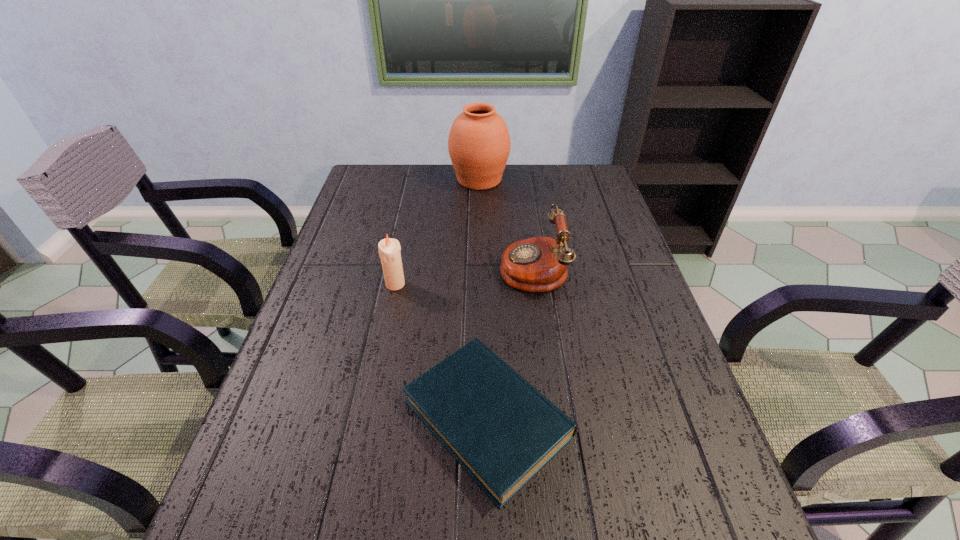
Locate an element on the screen. vacant region that satisfies the following two spatial constraints: 1. on the dial of the telephone; 2. on the front side of the book is located at coordinates click(553, 418).

I want to click on free space that satisfies the following two spatial constraints: 1. on the front side of the candle; 2. on the left side of the shortest object, so click(x=368, y=418).